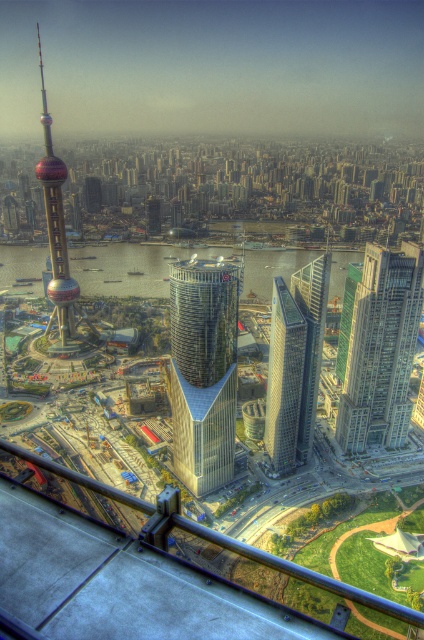
You are standing on an observation deck and see two points marked in the scene. The first point is at coordinate point (357,310) and the second is at point (293,276). Which point is closer to you?

Point (293,276) is closer to you because the point (357,310) is further away from the camera.